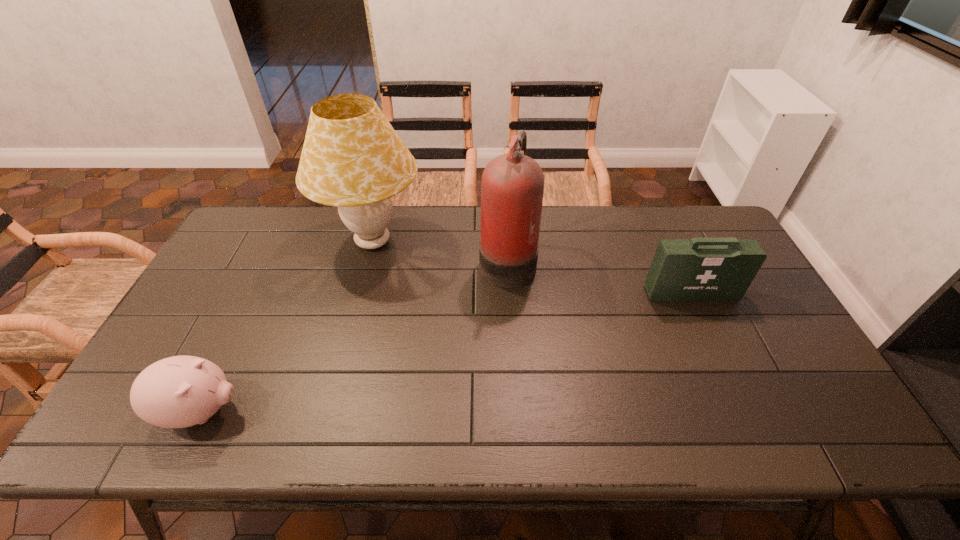
Where is `the second object from left to right`? The height and width of the screenshot is (540, 960). the second object from left to right is located at coordinates (352, 158).

Where is `fire extinguisher`? The image size is (960, 540). fire extinguisher is located at coordinates (512, 187).

The width and height of the screenshot is (960, 540). I want to click on the second shortest object, so click(x=704, y=269).

In order to click on the first-aid kit in this screenshot , I will do `click(704, 269)`.

The image size is (960, 540). I want to click on the nearest object, so click(181, 391).

The height and width of the screenshot is (540, 960). Find the location of `the leftmost object`. the leftmost object is located at coordinates (181, 391).

Where is `free space located on the front of the second object from left to right`? The width and height of the screenshot is (960, 540). free space located on the front of the second object from left to right is located at coordinates (334, 391).

The height and width of the screenshot is (540, 960). In order to click on vacant area situated at the nozzle of the second object from right to left in this screenshot , I will do `click(400, 259)`.

You are a GUI agent. You are given a task and a screenshot of the screen. Output one action in this format:
    pyautogui.click(x=<x>, y=<y>)
    Task: Click on the free space located at the nozzle of the second object from right to left
    Image resolution: width=960 pixels, height=540 pixels.
    Given the screenshot: What is the action you would take?
    pyautogui.click(x=451, y=259)

I want to click on vacant space situated at the nozzle of the second object from right to left, so click(352, 259).